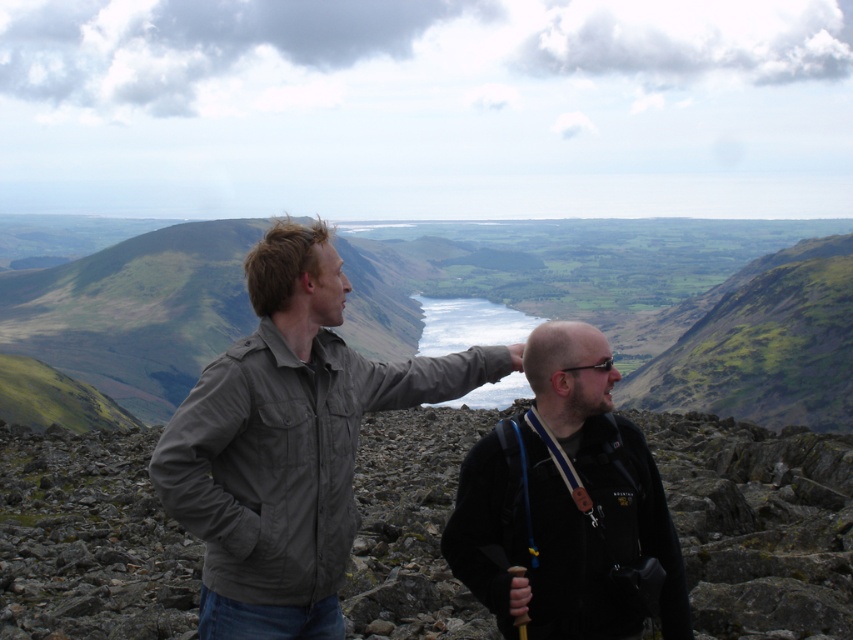
Which of these two, khaki fabric jacket at left or black fleece jacket at center, stands shorter?

black fleece jacket at center is shorter.

Can you confirm if khaki fabric jacket at left is smaller than black fleece jacket at center?

Actually, khaki fabric jacket at left might be larger than black fleece jacket at center.

Identify the location of khaki fabric jacket at left. tap(288, 442).

Identify the location of khaki fabric jacket at left. (288, 442).

Does rough stone boulders at center have a lesser width compared to khaki fabric jacket at left?

No.

Between rough stone boulders at center and khaki fabric jacket at left, which one has less height?

With less height is rough stone boulders at center.

Is point (440, 419) positioned behind point (277, 460)?

Yes, it is behind point (277, 460).

Locate an element on the screen. The height and width of the screenshot is (640, 853). rough stone boulders at center is located at coordinates (758, 524).

Does rough stone boulders at center appear on the right side of black fleece jacket at center?

Incorrect, rough stone boulders at center is not on the right side of black fleece jacket at center.

Between rough stone boulders at center and black fleece jacket at center, which one has more height?

black fleece jacket at center is taller.

Where is `rough stone boulders at center`? rough stone boulders at center is located at coordinates (758, 524).

Image resolution: width=853 pixels, height=640 pixels. Find the location of `rough stone boulders at center`. rough stone boulders at center is located at coordinates (758, 524).